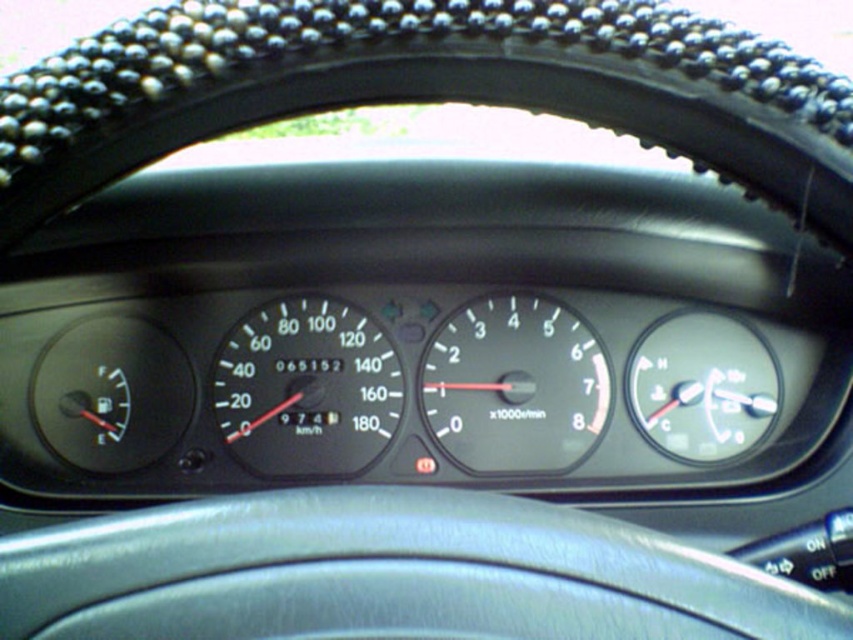
Question: Does black textured steering wheel at center appear on the left side of white plastic speedometer at center?

Choices:
 (A) yes
 (B) no

Answer: (A)

Question: Does black plastic speedometer at center appear under white plastic speedometer at center?

Choices:
 (A) no
 (B) yes

Answer: (A)

Question: Is white plastic speedometer at center wider than transparent plastic temperature gauge at right?

Choices:
 (A) no
 (B) yes

Answer: (B)

Question: Estimate the real-world distances between objects in this image. Which object is closer to the white plastic speedometer at center?

Choices:
 (A) black plastic speedometer at center
 (B) transparent plastic temperature gauge at right
 (C) black textured steering wheel at center

Answer: (B)

Question: Which object is farther from the camera taking this photo?

Choices:
 (A) black plastic speedometer at center
 (B) transparent plastic temperature gauge at right
 (C) black textured steering wheel at center
 (D) white plastic speedometer at center

Answer: (D)

Question: Estimate the real-world distances between objects in this image. Which object is closer to the transparent plastic temperature gauge at right?

Choices:
 (A) black textured steering wheel at center
 (B) white plastic speedometer at center

Answer: (B)